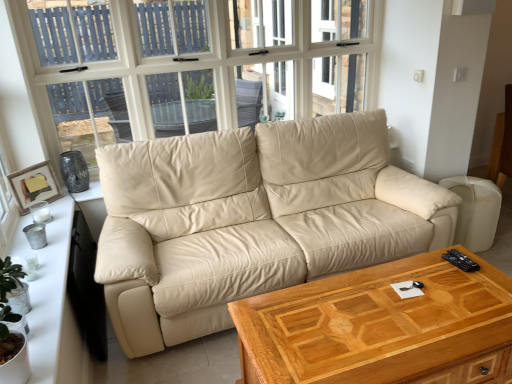
Locate an element on the screen. empty space that is ontop of wooden coffee table at center (from a real-world perspective) is located at coordinates (393, 314).